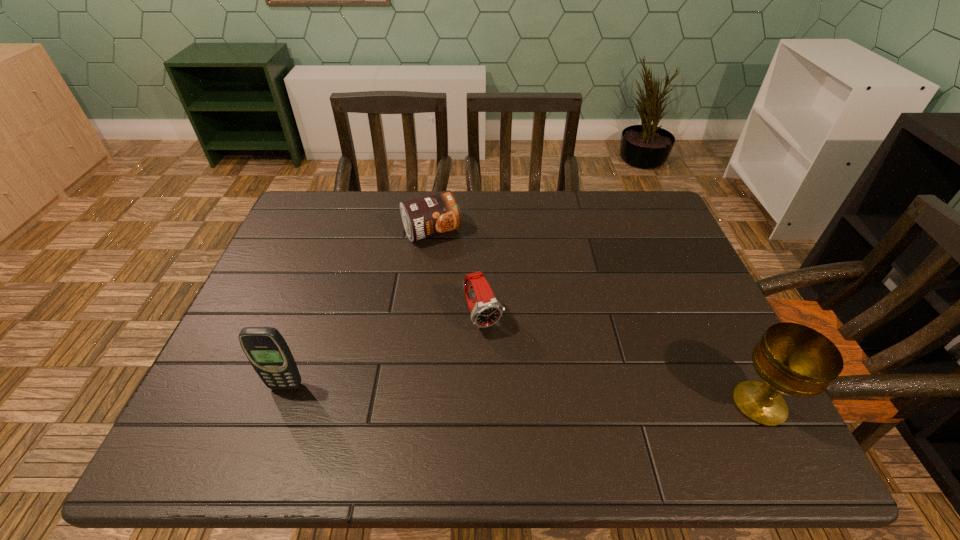
Image resolution: width=960 pixels, height=540 pixels. What are the coordinates of `cellular telephone` in the screenshot? It's located at (266, 349).

The height and width of the screenshot is (540, 960). I want to click on chalice, so click(x=793, y=359).

The image size is (960, 540). In order to click on the second object from left to right in this screenshot , I will do `click(431, 215)`.

Where is `can`? can is located at coordinates (431, 215).

Locate an element on the screen. the second object from right to left is located at coordinates (486, 311).

The width and height of the screenshot is (960, 540). I want to click on the third nearest object, so click(486, 311).

Find the location of a particular element. vacant area located on the screen of the cellular telephone is located at coordinates (276, 412).

Where is `vacant space situated 0.310m on the left of the rightmost object`? The height and width of the screenshot is (540, 960). vacant space situated 0.310m on the left of the rightmost object is located at coordinates click(574, 404).

The width and height of the screenshot is (960, 540). In order to click on free region located on the front label of the can in this screenshot , I will do `click(479, 306)`.

You are a GUI agent. You are given a task and a screenshot of the screen. Output one action in this format:
    pyautogui.click(x=<x>, y=<y>)
    Task: Click on the free space located on the front label of the can
    This screenshot has height=540, width=960.
    Given the screenshot: What is the action you would take?
    pyautogui.click(x=464, y=280)